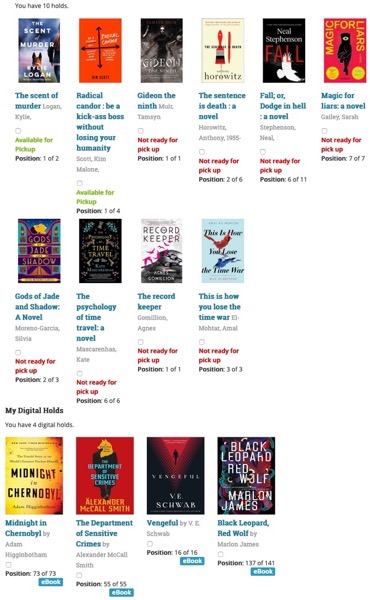
I want to click on books "not ready for pick up", so click(x=157, y=72), click(x=224, y=61), click(x=284, y=50), click(x=348, y=46), click(x=223, y=270), click(x=173, y=263), click(x=106, y=255), click(x=52, y=257).